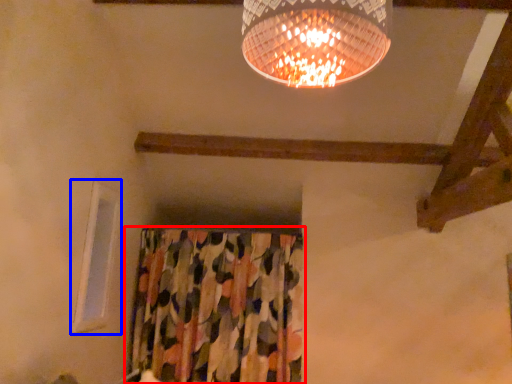
Question: Which object is closer to the camera taking this photo, curtain (highlighted by a red box) or window (highlighted by a blue box)?

Choices:
 (A) curtain
 (B) window

Answer: (B)